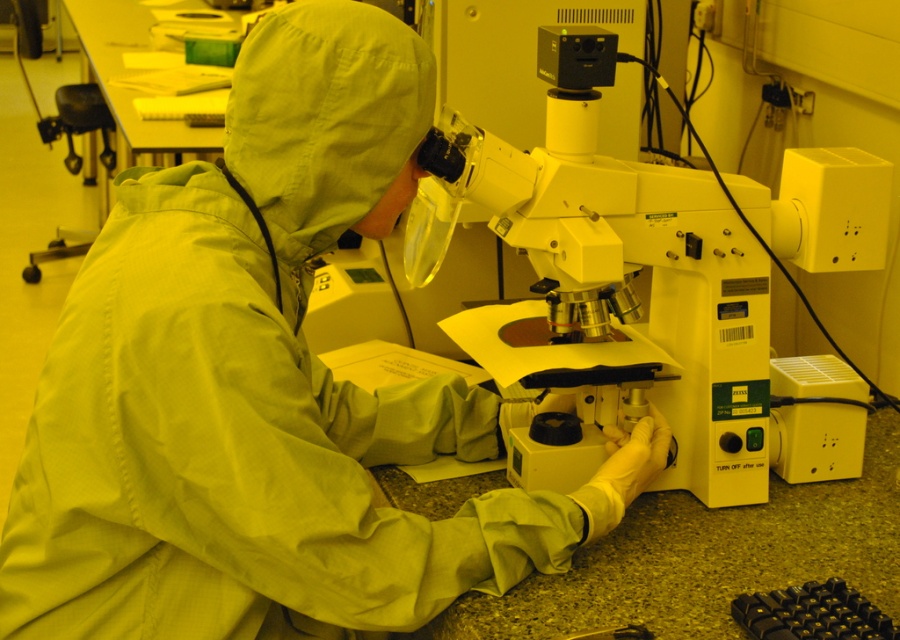
From the picture: Between green matte lab coat at center and white plastic microscope at center, which one is positioned lower?

green matte lab coat at center is lower down.

Is the position of green matte lab coat at center less distant than that of white plastic microscope at center?

Yes, it is.

Does point (95, 557) come farther from viewer compared to point (770, 442)?

No, (95, 557) is closer to viewer.

The width and height of the screenshot is (900, 640). Find the location of `green matte lab coat at center`. green matte lab coat at center is located at coordinates (266, 388).

Looking at this image, is green matte lab coat at center to the left of black rubber keyboard at lower right from the viewer's perspective?

Yes, green matte lab coat at center is to the left of black rubber keyboard at lower right.

Does green matte lab coat at center have a larger size compared to black rubber keyboard at lower right?

Indeed, green matte lab coat at center has a larger size compared to black rubber keyboard at lower right.

This screenshot has height=640, width=900. What do you see at coordinates (266, 388) in the screenshot?
I see `green matte lab coat at center` at bounding box center [266, 388].

This screenshot has height=640, width=900. I want to click on green matte lab coat at center, so [266, 388].

Is white plastic microscope at center further to camera compared to black rubber keyboard at lower right?

That is True.

Does point (612, 340) come farther from viewer compared to point (794, 611)?

Yes, point (612, 340) is behind point (794, 611).

At what (x,y) coordinates should I click in order to perform the action: click on white plastic microscope at center. Please return your answer as a coordinate pair (x, y). This screenshot has height=640, width=900. Looking at the image, I should click on (634, 272).